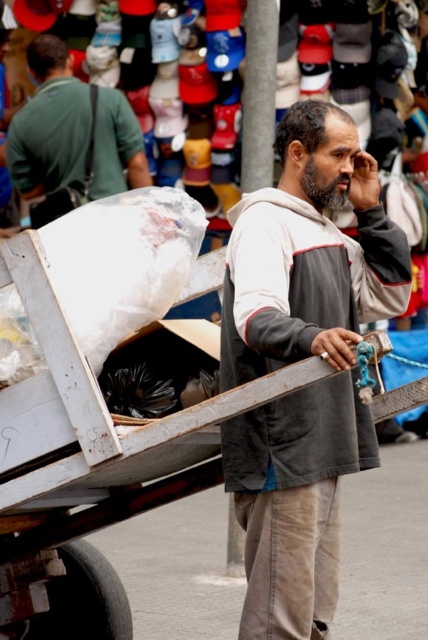
Question: Is gray cotton hoodie at center to the right of matte green shirt at upper left from the viewer's perspective?

Choices:
 (A) yes
 (B) no

Answer: (A)

Question: Which of the following is the farthest from the observer?

Choices:
 (A) (303, 502)
 (B) (55, 45)

Answer: (B)

Question: From the image, what is the correct spatial relationship of gray cotton hoodie at center in relation to matte green shirt at upper left?

Choices:
 (A) above
 (B) below

Answer: (B)

Question: Which of the following is the closest to the observer?

Choices:
 (A) [107, 129]
 (B) [222, 381]

Answer: (B)

Question: Does gray cotton hoodie at center appear under matte green shirt at upper left?

Choices:
 (A) no
 (B) yes

Answer: (B)